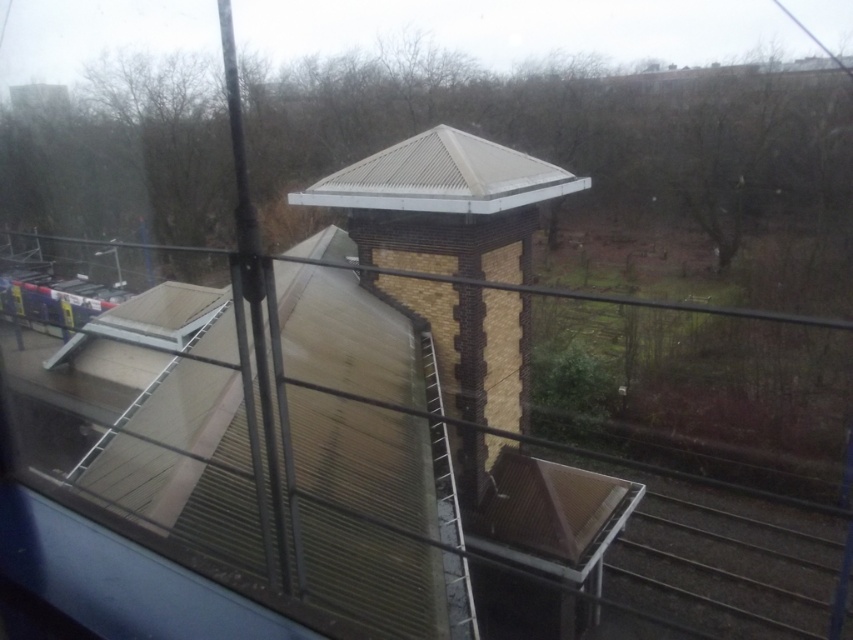
You are a passenger on the train and you notice the brick gazebo at center and the metallic corrugated roof at center outside the window. Which one appears larger in size?

The brick gazebo at center is bigger than the metallic corrugated roof at center, so the brick gazebo at center appears larger in size.

You are a passenger on a train and notice a brick gazebo at center and a metallic corrugated roof at center through the window. Which object is closer to you based on their positions?

The brick gazebo at center is closer to you because it is in front of the metallic corrugated roof at center.